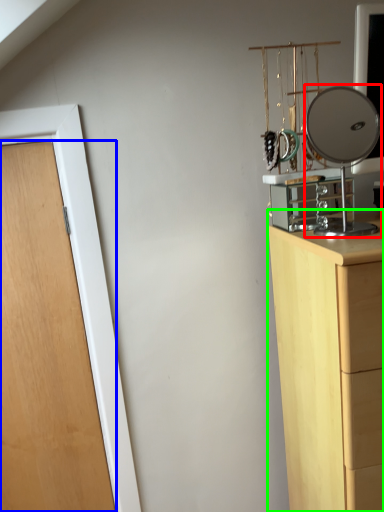
Question: Estimate the real-world distances between objects in this image. Which object is closer to mirror (highlighted by a red box), door (highlighted by a blue box) or chest of drawers (highlighted by a green box)?

Choices:
 (A) door
 (B) chest of drawers

Answer: (B)